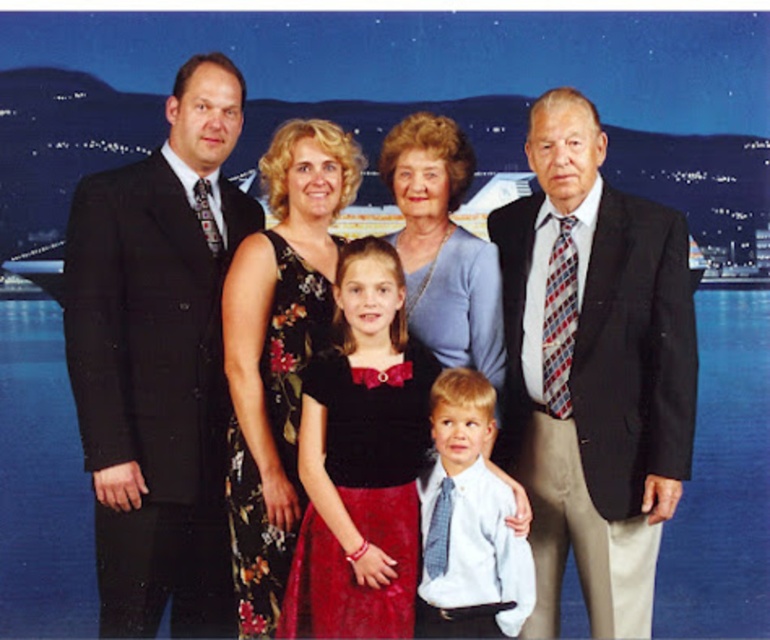
Is matte black suit at right below light blue shirt and tie at center?

Actually, matte black suit at right is above light blue shirt and tie at center.

Looking at this image, does matte black suit at right appear on the left side of light blue shirt and tie at center?

No, matte black suit at right is not to the left of light blue shirt and tie at center.

The width and height of the screenshot is (770, 640). What do you see at coordinates (593, 369) in the screenshot?
I see `matte black suit at right` at bounding box center [593, 369].

The height and width of the screenshot is (640, 770). I want to click on matte black suit at right, so click(x=593, y=369).

Does matte black suit at left appear on the left side of velvet black dress at center?

Yes, matte black suit at left is to the left of velvet black dress at center.

Between point (149, 605) and point (303, 422), which one is positioned behind?

The point (149, 605) is more distant.

The width and height of the screenshot is (770, 640). I want to click on matte black suit at left, so pyautogui.click(x=159, y=360).

Does matte black suit at right have a lesser width compared to matte black suit at left?

No, matte black suit at right is not thinner than matte black suit at left.

At what (x,y) coordinates should I click in order to perform the action: click on matte black suit at right. Please return your answer as a coordinate pair (x, y). The height and width of the screenshot is (640, 770). Looking at the image, I should click on (593, 369).

Where is `matte black suit at right`? matte black suit at right is located at coordinates (593, 369).